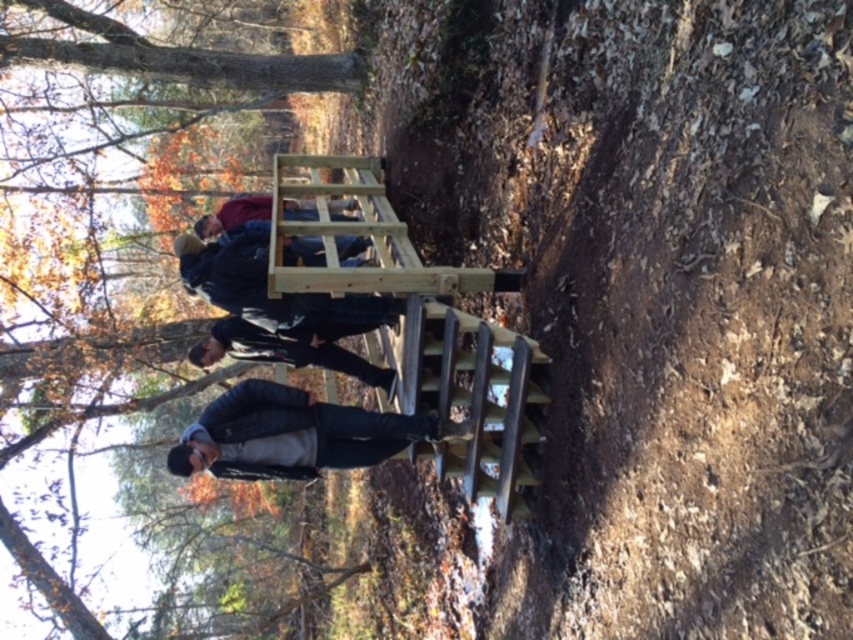
Between point (106, 364) and point (189, 433), which one is positioned behind?

The point (106, 364) is behind.

Does brown wood tree at upper center appear over black matte jacket at center?

Correct, brown wood tree at upper center is located above black matte jacket at center.

Is point (115, 429) positioned in front of point (287, 458)?

That is False.

Find the location of `brown wood tree at upper center`. brown wood tree at upper center is located at coordinates (114, 234).

Describe the element at coordinates (294, 435) in the screenshot. I see `black matte jacket at center` at that location.

Can you confirm if black matte jacket at center is taller than matte black jacket at center?

Indeed, black matte jacket at center has a greater height compared to matte black jacket at center.

This screenshot has width=853, height=640. I want to click on black matte jacket at center, so click(x=294, y=435).

I want to click on black matte jacket at center, so click(x=294, y=435).

Between brown wood tree at upper center and dark gray leather jacket at center, which one has more height?

A: dark gray leather jacket at center

Who is lower down, brown wood tree at upper center or dark gray leather jacket at center?

dark gray leather jacket at center

Who is more forward, (x=0, y=243) or (x=207, y=362)?

Positioned in front is point (x=207, y=362).

Where is `brown wood tree at upper center`? The height and width of the screenshot is (640, 853). brown wood tree at upper center is located at coordinates (114, 234).